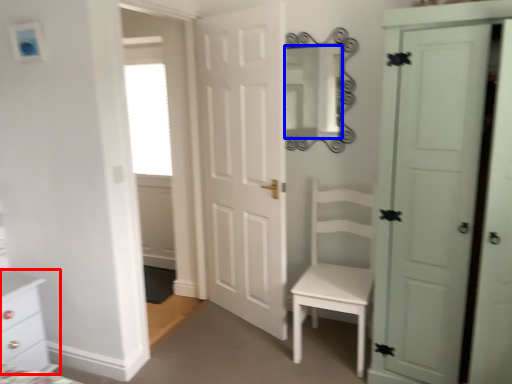
Question: Which object is further to the camera taking this photo, chest of drawers (highlighted by a red box) or mirror (highlighted by a blue box)?

Choices:
 (A) chest of drawers
 (B) mirror

Answer: (B)